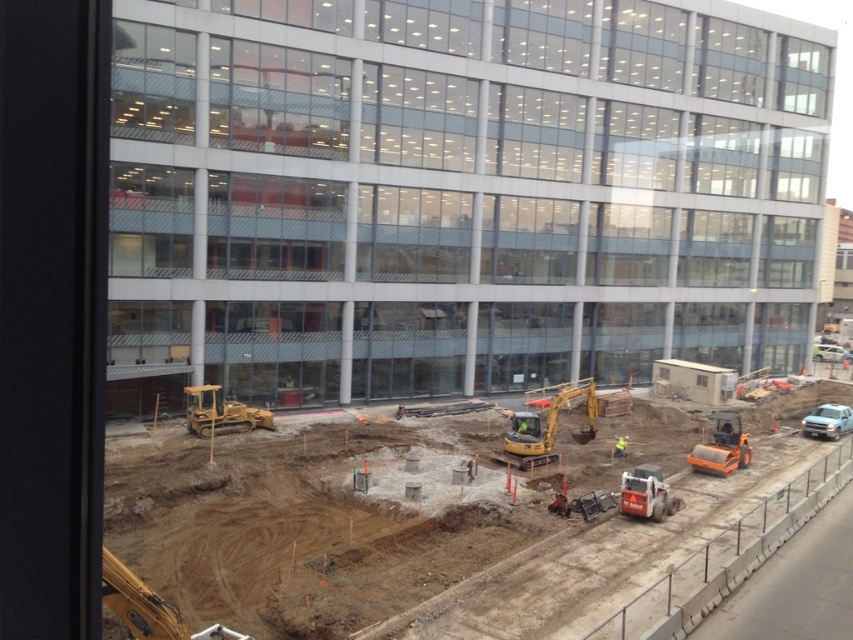
Question: Is yellow rubber bulldozer at lower center closer to the viewer compared to orange rubber roller at lower right?

Choices:
 (A) no
 (B) yes

Answer: (A)

Question: Which object appears closest to the camera in this image?

Choices:
 (A) yellow rubber excavator at center
 (B) orange rubber skid steer loader at lower right
 (C) clear glass building at center

Answer: (C)

Question: Estimate the real-world distances between objects in this image. Which object is closer to the brown dirt at lower center?

Choices:
 (A) orange rubber roller at lower right
 (B) orange rubber skid steer loader at lower right
 (C) yellow rubber excavator at center

Answer: (B)

Question: Is yellow rubber excavator at center smaller than yellow rubber bulldozer at lower center?

Choices:
 (A) no
 (B) yes

Answer: (A)

Question: Which point is closer to the camera?

Choices:
 (A) (432, 586)
 (B) (225, 410)
 (C) (633, 182)

Answer: (A)

Question: Is clear glass building at center above yellow rubber bulldozer at lower center?

Choices:
 (A) no
 (B) yes

Answer: (B)